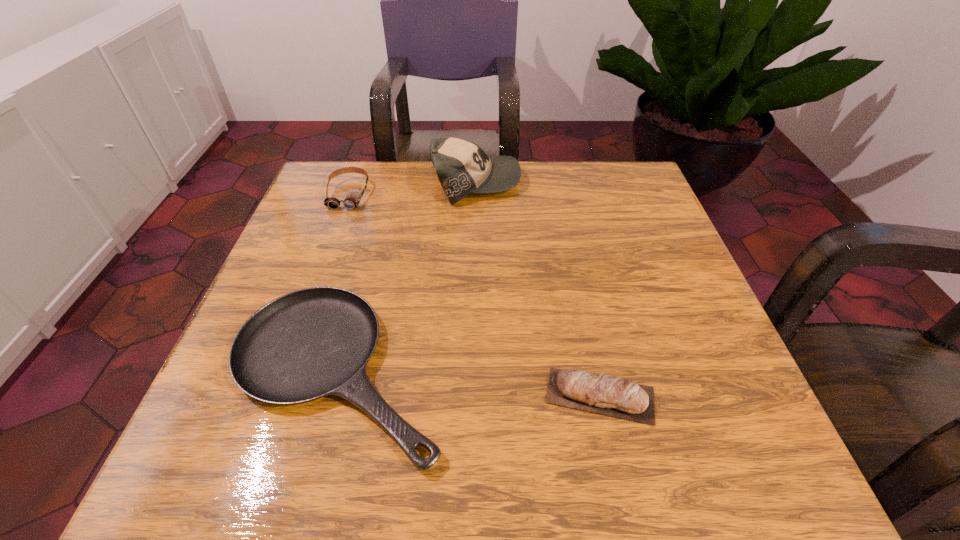
The height and width of the screenshot is (540, 960). Find the location of `vacant space at the left edge of the desktop`. vacant space at the left edge of the desktop is located at coordinates (353, 260).

In the image, there is a desktop. At what (x,y) coordinates should I click in order to perform the action: click on vacant area at the right edge. Please return your answer as a coordinate pair (x, y). Image resolution: width=960 pixels, height=540 pixels. Looking at the image, I should click on (682, 276).

In the image, there is a desktop. At what (x,y) coordinates should I click in order to perform the action: click on free space at the far right corner. Please return your answer as a coordinate pair (x, y). Looking at the image, I should click on (617, 204).

Find the location of a particular element. free space between the goggles and the tallest object is located at coordinates (413, 188).

The image size is (960, 540). I want to click on vacant area that lies between the frying pan and the baseball cap, so click(x=407, y=276).

Locate an element on the screen. This screenshot has width=960, height=540. free space between the frying pan and the tallest object is located at coordinates (407, 276).

At what (x,y) coordinates should I click in order to perform the action: click on vacant area that lies between the pita bread and the tallest object. Please return your answer as a coordinate pair (x, y). Looking at the image, I should click on (538, 289).

Image resolution: width=960 pixels, height=540 pixels. In order to click on free area in between the shortest object and the tallest object in this screenshot , I will do `click(407, 276)`.

Image resolution: width=960 pixels, height=540 pixels. I want to click on vacant area that lies between the tallest object and the goggles, so click(x=413, y=188).

Locate an element on the screen. The image size is (960, 540). vacant area that lies between the tallest object and the pita bread is located at coordinates (538, 289).